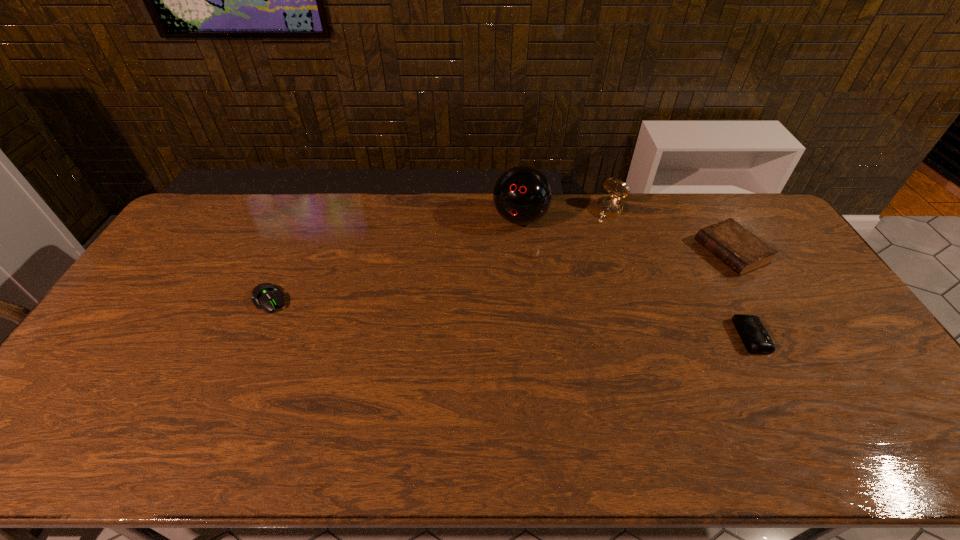
Where is `vacant space on the desktop that is between the computer mouse and the nearest object and is positioned on the surface of the bowling ball near the finger holes`? vacant space on the desktop that is between the computer mouse and the nearest object and is positioned on the surface of the bowling ball near the finger holes is located at coordinates (475, 315).

The image size is (960, 540). Find the location of `vacant spot on the desktop that is between the leftmost object and the nearest object and is positioned with the dial facing the third object from right to left`. vacant spot on the desktop that is between the leftmost object and the nearest object and is positioned with the dial facing the third object from right to left is located at coordinates (512, 318).

Find the location of `free space on the desktop that is between the computer mouse and the alarm clock and is positioned on the spine side of the diary`. free space on the desktop that is between the computer mouse and the alarm clock and is positioned on the spine side of the diary is located at coordinates (557, 321).